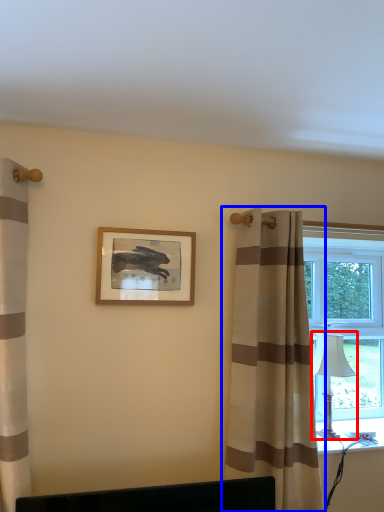
Question: Which point is further to the camera, table lamp (highlighted by a red box) or curtain (highlighted by a blue box)?

Choices:
 (A) table lamp
 (B) curtain

Answer: (A)